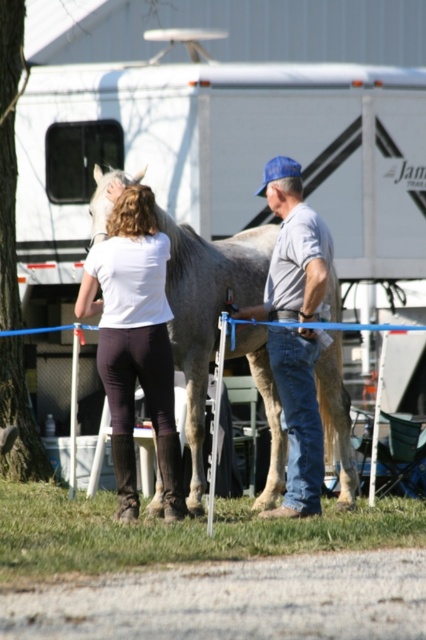
Between white plastic trailer at upper center and gray matte horse at center, which one has more height?

gray matte horse at center is taller.

Is white plastic trailer at upper center shorter than gray matte horse at center?

Yes.

The height and width of the screenshot is (640, 426). Describe the element at coordinates (221, 177) in the screenshot. I see `white plastic trailer at upper center` at that location.

Identify the location of white plastic trailer at upper center. This screenshot has width=426, height=640. (221, 177).

Is white plastic trailer at upper center taller than gray denim jeans at center?

In fact, white plastic trailer at upper center may be shorter than gray denim jeans at center.

Which of these two, white plastic trailer at upper center or gray denim jeans at center, stands taller?

gray denim jeans at center

Image resolution: width=426 pixels, height=640 pixels. I want to click on white plastic trailer at upper center, so click(x=221, y=177).

Where is `white plastic trailer at upper center`? The height and width of the screenshot is (640, 426). white plastic trailer at upper center is located at coordinates (221, 177).

Is point (264, 362) farther from camera compared to point (250, 308)?

Yes, point (264, 362) is farther from viewer.

Can you confirm if gray matte horse at center is smaller than gray denim jeans at center?

No.

Between point (183, 362) and point (287, 163), which one is positioned in front?

Point (287, 163) is more forward.

The height and width of the screenshot is (640, 426). I want to click on gray matte horse at center, so click(207, 310).